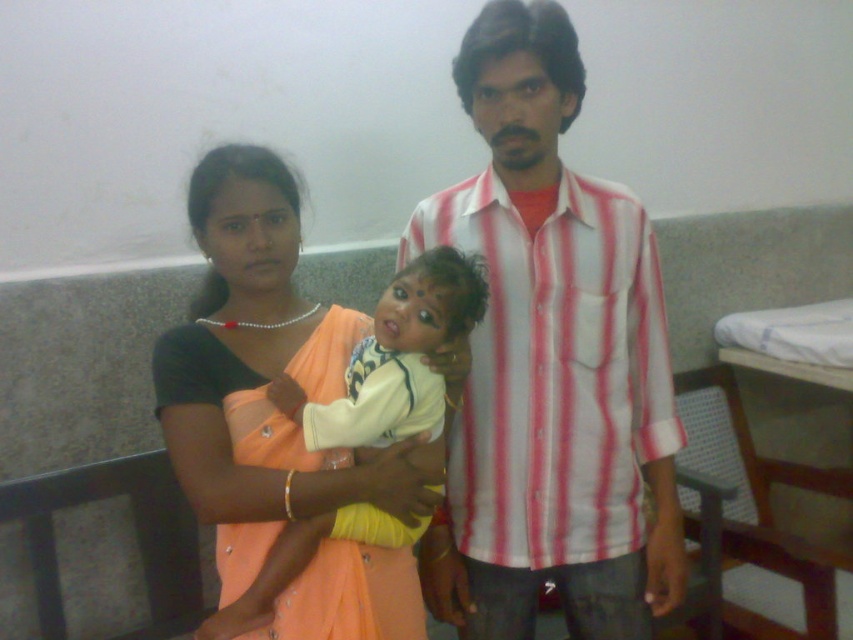
Question: Does striped cotton shirt at center lie in front of matte orange sari at center?

Choices:
 (A) yes
 (B) no

Answer: (B)

Question: Which object is closer to the camera taking this photo?

Choices:
 (A) matte orange sari at center
 (B) striped cotton shirt at center

Answer: (A)

Question: Is striped cotton shirt at center below matte orange sari at center?

Choices:
 (A) no
 (B) yes

Answer: (A)

Question: Which object appears closest to the camera in this image?

Choices:
 (A) striped cotton shirt at center
 (B) matte orange sari at center

Answer: (B)

Question: Can you confirm if striped cotton shirt at center is positioned to the right of matte orange sari at center?

Choices:
 (A) yes
 (B) no

Answer: (A)